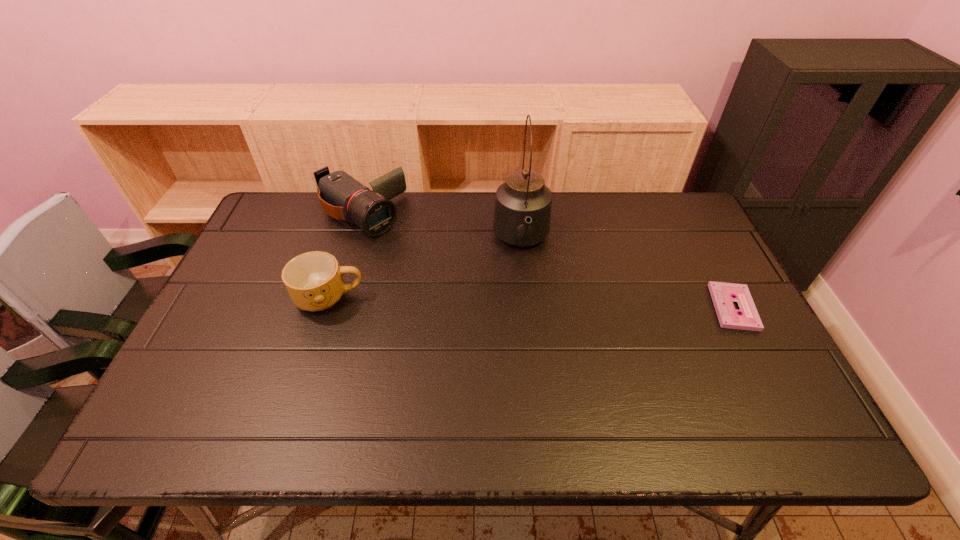
I want to click on empty location between the mug and the kettle, so click(425, 269).

Locate an element on the screen. The width and height of the screenshot is (960, 540). vacant space that's between the camcorder and the rightmost object is located at coordinates (546, 262).

Find the location of a particular element. This screenshot has height=540, width=960. free space that is in between the tallest object and the mug is located at coordinates (425, 269).

Locate an element on the screen. The height and width of the screenshot is (540, 960). free area in between the camcorder and the second shortest object is located at coordinates (344, 256).

Image resolution: width=960 pixels, height=540 pixels. In order to click on free space between the tallest object and the shortest object in this screenshot , I will do `click(627, 274)`.

What are the coordinates of `free space between the second object from right to left and the second shortest object` in the screenshot? It's located at (425, 269).

The image size is (960, 540). What are the coordinates of `object that is the second closest one to the shortest object` in the screenshot? It's located at (341, 196).

I want to click on the second closest object to the second object from right to left, so click(314, 281).

This screenshot has height=540, width=960. I want to click on free region that satisfies the following two spatial constraints: 1. on the front side of the rightmost object; 2. on the left side of the tallest object, so click(528, 307).

Identify the location of free location that satisfies the following two spatial constraints: 1. on the front side of the rightmost object; 2. on the left side of the camcorder. The height and width of the screenshot is (540, 960). (330, 307).